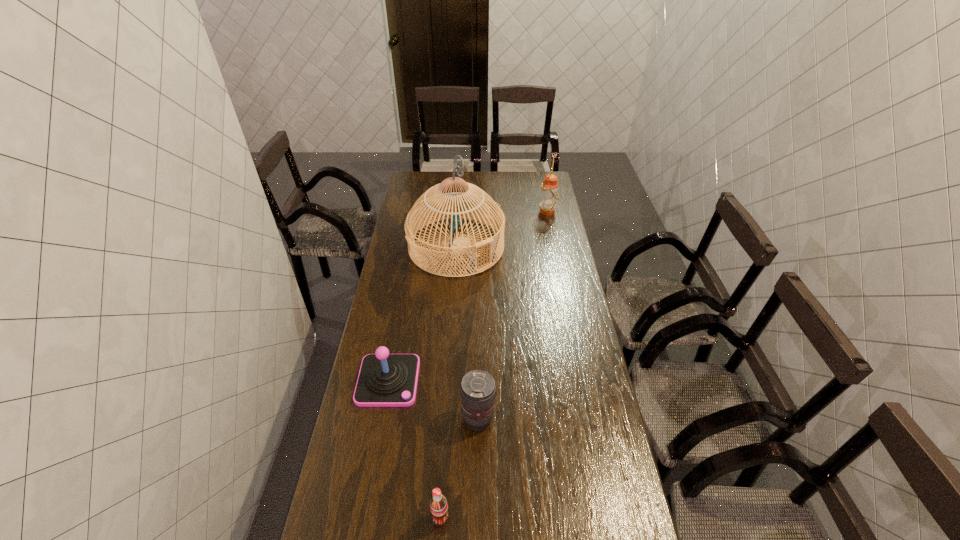
At what (x,y) coordinates should I click in order to perform the action: click on the fourth nearest object. Please return your answer as a coordinate pair (x, y). Looking at the image, I should click on (461, 201).

Identify the location of the tallest object. (461, 201).

Identify the location of oil lamp. (549, 194).

The image size is (960, 540). What are the coordinates of `the second tallest object` in the screenshot? It's located at (549, 194).

You are a GUI agent. You are given a task and a screenshot of the screen. Output one action in this format:
    pyautogui.click(x=<x>, y=<y>)
    Task: Click on the telephoto lens
    This screenshot has height=540, width=960.
    Given the screenshot: What is the action you would take?
    pyautogui.click(x=478, y=388)

You are a GUI agent. You are given a task and a screenshot of the screen. Output one action in this format:
    pyautogui.click(x=<x>, y=<y>)
    Task: Click on the joystick
    The height and width of the screenshot is (540, 960).
    Given the screenshot: What is the action you would take?
    [x=385, y=380]

This screenshot has height=540, width=960. I want to click on the nearest object, so click(438, 505).

Where is `vacant area situated on the right of the tallest object`? Image resolution: width=960 pixels, height=540 pixels. vacant area situated on the right of the tallest object is located at coordinates (533, 246).

Locate an element on the screen. free space located on the front of the farthest object is located at coordinates (555, 246).

You are a GUI agent. You are given a task and a screenshot of the screen. Output one action in this format:
    pyautogui.click(x=<x>, y=<y>)
    Task: Click on the vacant region located 0.330m on the side of the telephoto lens where the control switches are located
    Image resolution: width=960 pixels, height=540 pixels.
    Given the screenshot: What is the action you would take?
    pyautogui.click(x=602, y=419)